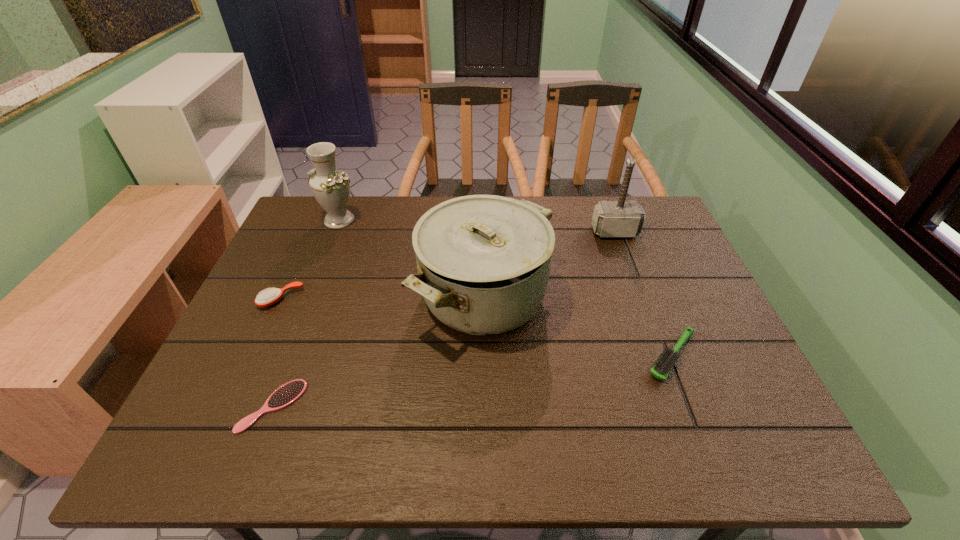
Identify the location of free space located 0.400m on the left of the rightmost hairbrush. The height and width of the screenshot is (540, 960). click(469, 356).

The width and height of the screenshot is (960, 540). I want to click on vacant position located on the right of the shortest object, so click(x=430, y=406).

Where is `vase that is at the far edge`? vase that is at the far edge is located at coordinates (331, 188).

Where is `hammer that is positioned at the far edge`? hammer that is positioned at the far edge is located at coordinates (621, 218).

Locate an element on the screen. The width and height of the screenshot is (960, 540). object that is at the near edge is located at coordinates coord(287,394).

What are the coordinates of `vase positioned at the left edge` in the screenshot? It's located at [331, 188].

The width and height of the screenshot is (960, 540). What are the coordinates of `hammer at the right edge` in the screenshot? It's located at (621, 218).

Find the location of `hairbrush located in the right edge section of the desktop`. hairbrush located in the right edge section of the desktop is located at coordinates (663, 366).

Find the location of `object that is at the far left corner`. object that is at the far left corner is located at coordinates (331, 188).

Locate an element on the screen. The height and width of the screenshot is (540, 960). object at the near left corner is located at coordinates (287, 394).